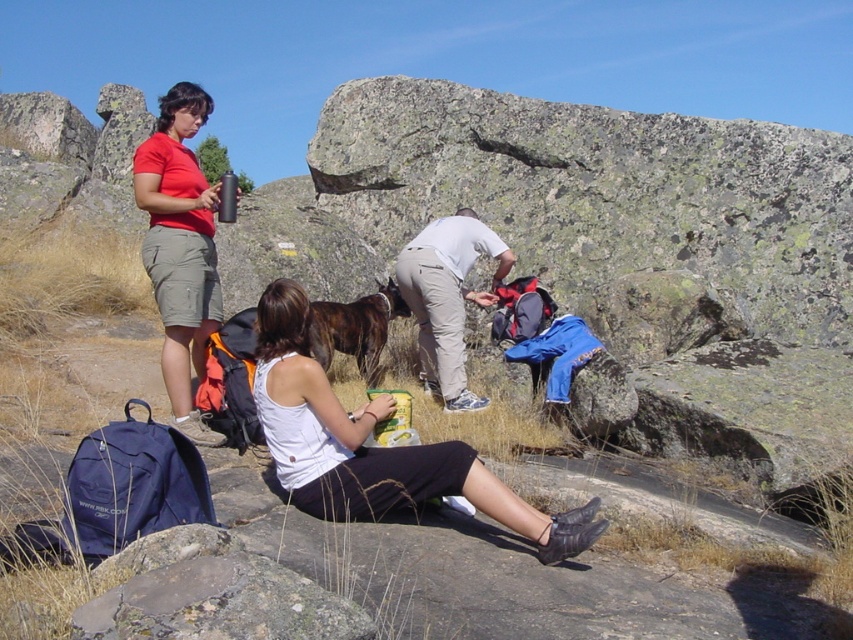
You are standing at the point marked as point (277, 358) in the image. You want to walk towards the nearest large boulder. The nearest large boulder is 5 meters away from you. Can you safely walk to it without needing to go beyond 5 meters?

The distance of point (277, 358) from viewer is 4.89 meters. Since the nearest large boulder is 5 meters away, you can safely walk to it without exceeding the 5 meter limit.

You are a hiker trying to identify clothing items in the scene. Which clothing item is bigger in size between the white fabric tank top at center and the white matte shirt at center?

The white fabric tank top at center is larger in size compared to the white matte shirt at center according to the description.